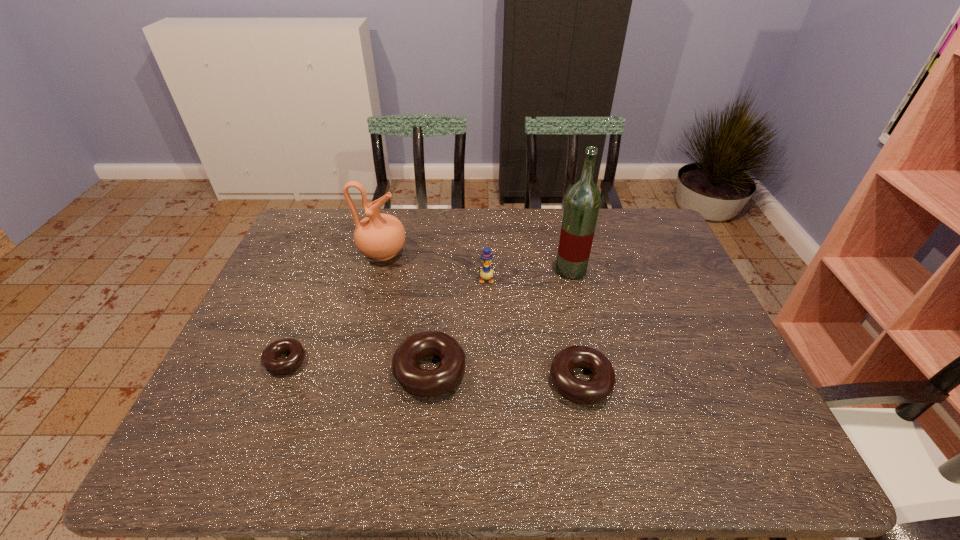
Find the location of a particular element. The height and width of the screenshot is (540, 960). free space that satisfies the following two spatial constraints: 1. on the spout of the second tallest object; 2. on the back side of the tallest object is located at coordinates (378, 270).

At what (x,y) coordinates should I click in order to perform the action: click on vacant space that satisfies the following two spatial constraints: 1. on the spout of the fifth shortest object; 2. on the right side of the third object from left to right. Please return your answer as a coordinate pair (x, y). Looking at the image, I should click on (352, 371).